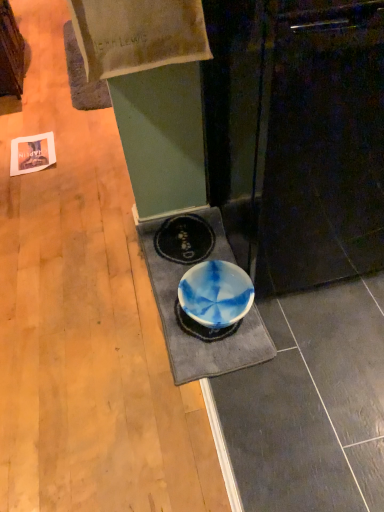
Looking at this image, measure the distance between blue fabric bath mat at center and camera.

blue fabric bath mat at center is 1.28 meters away from camera.

What do you see at coordinates (193, 337) in the screenshot? The height and width of the screenshot is (512, 384). I see `blue fabric bath mat at center` at bounding box center [193, 337].

You are a GUI agent. You are given a task and a screenshot of the screen. Output one action in this format:
    pyautogui.click(x=<x>, y=<y>)
    Task: Click on the blue fabric bath mat at center
    The image size is (384, 512).
    Given the screenshot: What is the action you would take?
    pyautogui.click(x=193, y=337)

At what (x,y) coordinates should I click in order to perform the action: click on blue fabric bath mat at center. Please return your answer as a coordinate pair (x, y). Looking at the image, I should click on (193, 337).